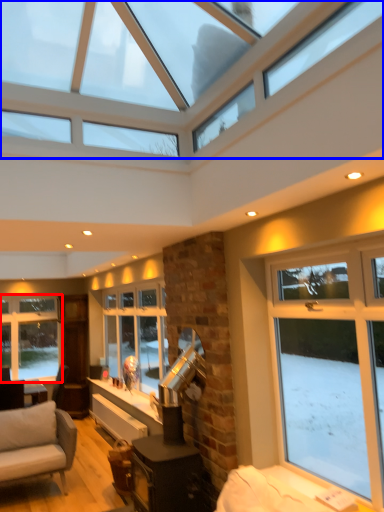
Question: Which object is further to the camera taking this photo, window (highlighted by a red box) or window (highlighted by a blue box)?

Choices:
 (A) window
 (B) window

Answer: (A)